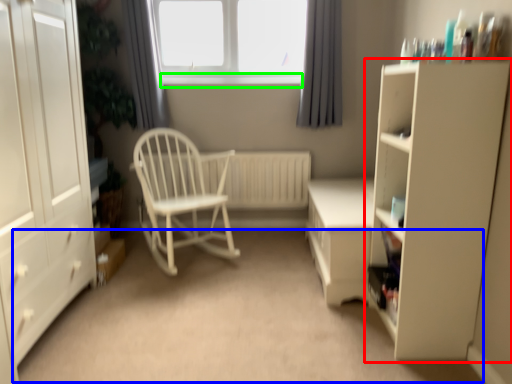
Question: Estimate the real-world distances between objects in this image. Which object is closer to cupboard (highlighted by a red box), plain (highlighted by a blue box) or window sill (highlighted by a green box)?

Choices:
 (A) plain
 (B) window sill

Answer: (A)